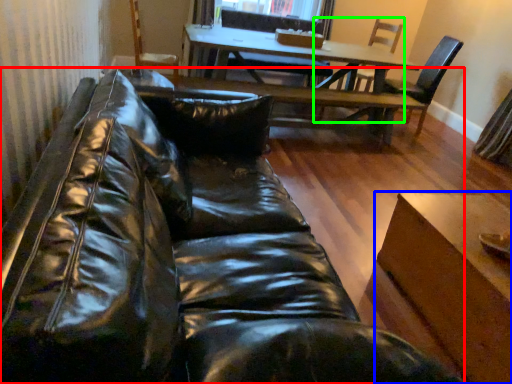
Question: Which object is positioned farthest from studio couch (highlighted by a red box)? Select from table (highlighted by a blue box) and chair (highlighted by a green box).

Choices:
 (A) table
 (B) chair

Answer: (B)